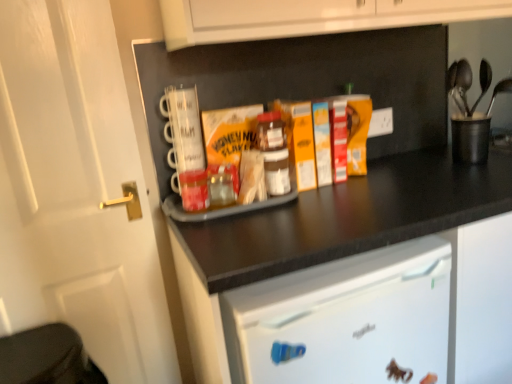
Question: Is the depth of black plastic utensil holder at upper right less than that of translucent plastic jar at center?

Choices:
 (A) yes
 (B) no

Answer: (B)

Question: Considering the relative sizes of black plastic utensil holder at upper right and translucent plastic jar at center in the image provided, is black plastic utensil holder at upper right shorter than translucent plastic jar at center?

Choices:
 (A) no
 (B) yes

Answer: (A)

Question: From the image's perspective, is black plastic utensil holder at upper right over translucent plastic jar at center?

Choices:
 (A) no
 (B) yes

Answer: (B)

Question: Is black plastic utensil holder at upper right positioned beyond the bounds of translucent plastic jar at center?

Choices:
 (A) no
 (B) yes

Answer: (B)

Question: From a real-world perspective, does black plastic utensil holder at upper right sit lower than translucent plastic jar at center?

Choices:
 (A) yes
 (B) no

Answer: (A)

Question: Considering the relative sizes of black plastic utensil holder at upper right and translucent plastic jar at center in the image provided, is black plastic utensil holder at upper right taller than translucent plastic jar at center?

Choices:
 (A) no
 (B) yes

Answer: (B)

Question: Can we say white matte door at left lies outside black matte tray at center?

Choices:
 (A) yes
 (B) no

Answer: (A)

Question: Is white matte door at left taller than black matte tray at center?

Choices:
 (A) yes
 (B) no

Answer: (A)

Question: Is white matte door at left oriented away from black matte tray at center?

Choices:
 (A) yes
 (B) no

Answer: (B)

Question: Is the position of white matte door at left more distant than that of black matte tray at center?

Choices:
 (A) no
 (B) yes

Answer: (B)

Question: From the image's perspective, is white matte door at left beneath black matte tray at center?

Choices:
 (A) no
 (B) yes

Answer: (A)

Question: Considering the relative sizes of white matte door at left and black matte tray at center in the image provided, is white matte door at left smaller than black matte tray at center?

Choices:
 (A) yes
 (B) no

Answer: (A)

Question: From the image's perspective, is translucent plastic jar at center under black plastic utensil holder at upper right?

Choices:
 (A) yes
 (B) no

Answer: (A)